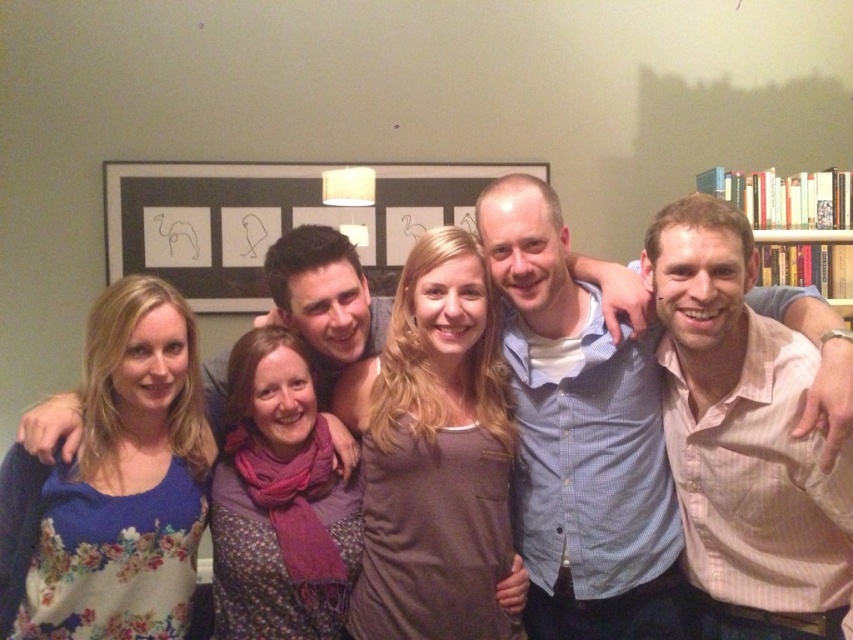
You are a photographer standing in the living room and want to take a closeup shot of the matte black picture frame at center. You have a camera with a 50mm lens. Considering the minimum focusing distance of this lens is 0.5 meters, can you take the photo without moving closer?

The matte black picture frame at center is 3.28 meters away from the viewer. Since the minimum focusing distance of the 50mm lens is 0.5 meters, the photographer can take the closeup shot without moving closer because the lens can focus at that distance.